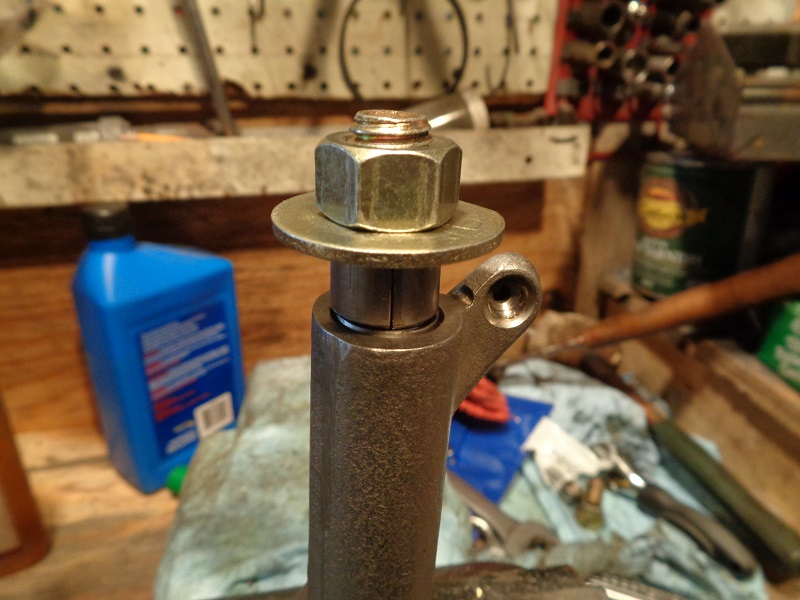
This screenshot has width=800, height=600. In order to click on blue jug in this screenshot , I will do `click(126, 278)`.